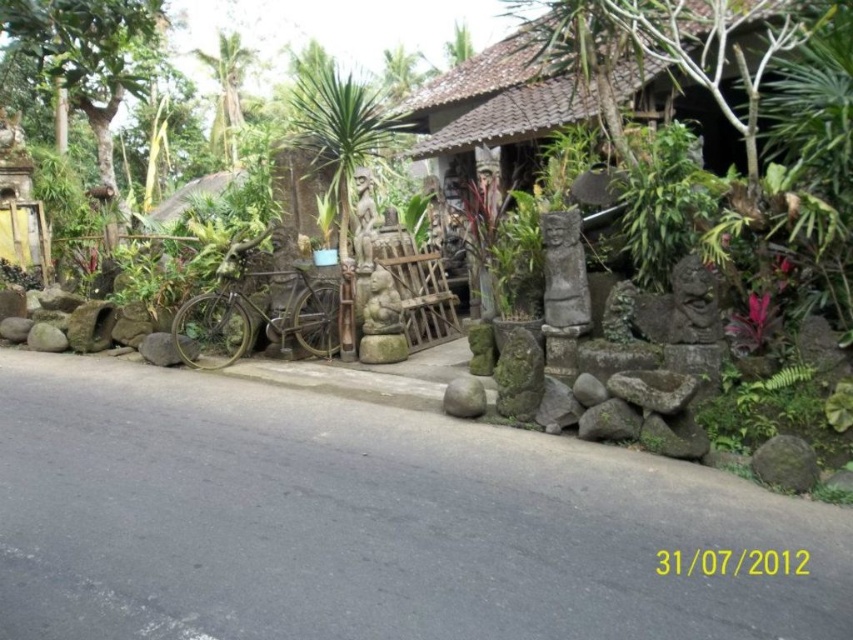
You are standing at the edge of the paved road in the scene. You see the brown textured hut at center and the rustic stone at center. Which object is closer to you?

The brown textured hut at center is closer to the viewer than the rustic stone at center.

You are planning to set up a small garden between the brown textured hut at center and the rusty metal bicycle at center. Considering their widths, which object should be placed closer to the path to ensure the garden has enough space?

The brown textured hut at center has a lesser width compared to the rusty metal bicycle at center, so placing the narrower brown textured hut at center closer to the path would leave more space for the garden between them.